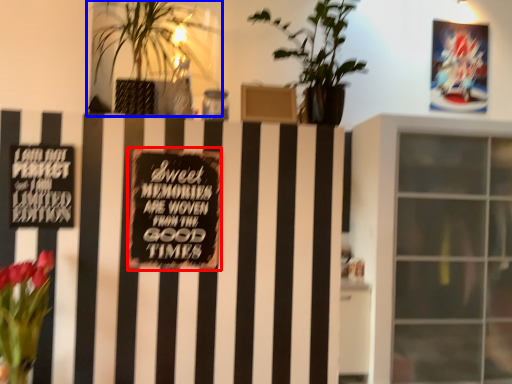
Question: Among these objects, which one is nearest to the camera, plaque (highlighted by a red box) or houseplant (highlighted by a blue box)?

Choices:
 (A) plaque
 (B) houseplant

Answer: (B)